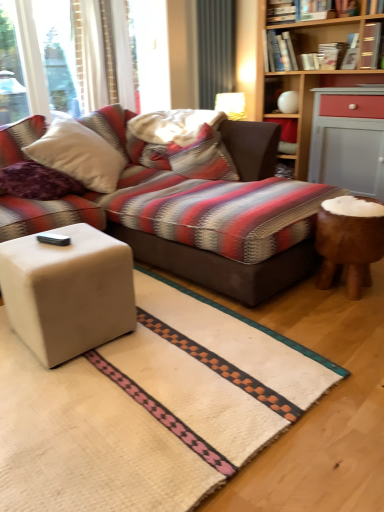
Locate an element on the screen. The width and height of the screenshot is (384, 512). striped fabric pillow at center, the first pillow when ordered from right to left is located at coordinates (193, 157).

The height and width of the screenshot is (512, 384). What do you see at coordinates (37, 182) in the screenshot?
I see `purple soft pillow at left, arranged as the 1th pillow when viewed from the left` at bounding box center [37, 182].

What do you see at coordinates (370, 45) in the screenshot? Image resolution: width=384 pixels, height=512 pixels. I see `wooden book at upper right, which is the seventh book from left to right` at bounding box center [370, 45].

The width and height of the screenshot is (384, 512). Describe the element at coordinates (279, 52) in the screenshot. I see `hardcover book at upper right, arranged as the 6th book when viewed from the right` at that location.

This screenshot has width=384, height=512. I want to click on hardcover book at upper right, the fourth book viewed from the right, so click(331, 55).

Does beige matte cube at lower left contain wooden book at upper right, which is the seventh book from left to right?

No, wooden book at upper right, which is the seventh book from left to right, is located outside of beige matte cube at lower left.

Can you tell me how much beige matte cube at lower left and wooden book at upper right, the first book viewed from the right, differ in facing direction?

The angle between the facing direction of beige matte cube at lower left and the facing direction of wooden book at upper right, the first book viewed from the right, is 82.6 degrees.

Is beige matte cube at lower left shorter than wooden book at upper right, the first book viewed from the right?

No.

From a real-world perspective, which is physically above, beige matte cube at lower left or wooden book at upper right, which is the seventh book from left to right?

From a 3D spatial view, wooden book at upper right, which is the seventh book from left to right, is above.

Is beige matte cube at lower left directly adjacent to hardcover book at upper right, placed as the 4th book when sorted from left to right?

No, beige matte cube at lower left is not touching hardcover book at upper right, placed as the 4th book when sorted from left to right.

From a real-world perspective, which object rests below the other?

beige matte cube at lower left is physically lower.

Considering the relative sizes of beige matte cube at lower left and hardcover book at upper right, the fourth book viewed from the right, in the image provided, is beige matte cube at lower left thinner than hardcover book at upper right, the fourth book viewed from the right,?

No.

Considering the positions of objects hardcover book at upper center, which is counted as the 3th book, starting from the left, and wooden book at upper right, which is the seventh book from left to right, in the image provided, who is more to the right, hardcover book at upper center, which is counted as the 3th book, starting from the left, or wooden book at upper right, which is the seventh book from left to right,?

From the viewer's perspective, wooden book at upper right, which is the seventh book from left to right, appears more on the right side.

How many degrees apart are the facing directions of hardcover book at upper center, positioned as the fifth book in right-to-left order, and wooden book at upper right, which is the seventh book from left to right?

There is a 0.0022-degree angle between the facing directions of hardcover book at upper center, positioned as the fifth book in right-to-left order, and wooden book at upper right, which is the seventh book from left to right.

Who is shorter, hardcover book at upper center, positioned as the fifth book in right-to-left order, or wooden book at upper right, which is the seventh book from left to right?

Standing shorter between the two is hardcover book at upper center, positioned as the fifth book in right-to-left order.

Between hardcover book at upper center, which is counted as the 3th book, starting from the left, and wooden book at upper right, the first book viewed from the right, which one has larger size?

With larger size is wooden book at upper right, the first book viewed from the right.

Is wooden book at upper right, the first book viewed from the right, far from wooden stool at right?

Yes, wooden book at upper right, the first book viewed from the right, is far from wooden stool at right.

Can you confirm if wooden book at upper right, which is the seventh book from left to right, is positioned to the left of wooden stool at right?

In fact, wooden book at upper right, which is the seventh book from left to right, is to the right of wooden stool at right.

I want to click on book that is the 1st object located above the wooden stool at right (from the image's perspective), so click(x=370, y=45).

Who is more distant, wooden book at upper right, the first book viewed from the right, or wooden stool at right?

wooden book at upper right, the first book viewed from the right.

Is hardcover book at upper right, arranged as the third book when viewed from the right, at the back of hardcover book at upper right, placed as the 4th book when sorted from left to right?

No, hardcover book at upper right, arranged as the third book when viewed from the right, is not at the back of hardcover book at upper right, placed as the 4th book when sorted from left to right.

From a real-world perspective, is hardcover book at upper right, the fourth book viewed from the right, physically above hardcover book at upper right, arranged as the third book when viewed from the right?

No, from a real-world perspective, hardcover book at upper right, the fourth book viewed from the right, is not on top of hardcover book at upper right, arranged as the third book when viewed from the right.

Considering the sizes of objects hardcover book at upper right, the fourth book viewed from the right, and hardcover book at upper right, positioned as the 5th book in left-to-right order, in the image provided, who is thinner, hardcover book at upper right, the fourth book viewed from the right, or hardcover book at upper right, positioned as the 5th book in left-to-right order,?

hardcover book at upper right, positioned as the 5th book in left-to-right order.

From the image's perspective, which is below, purple soft pillow at left, acting as the first pillow starting from the front, or hardcover book at upper center, which is the first book in left-to-right order?

From the image's view, purple soft pillow at left, acting as the first pillow starting from the front, is below.

Considering the sizes of objects purple soft pillow at left, acting as the first pillow starting from the front, and hardcover book at upper center, which is the first book in left-to-right order, in the image provided, who is bigger, purple soft pillow at left, acting as the first pillow starting from the front, or hardcover book at upper center, which is the first book in left-to-right order,?

With larger size is purple soft pillow at left, acting as the first pillow starting from the front.

In the scene shown: From a real-world perspective, is purple soft pillow at left, acting as the first pillow starting from the front, below hardcover book at upper center, the 7th book positioned from the right?

Indeed, from a real-world perspective, purple soft pillow at left, acting as the first pillow starting from the front, is positioned beneath hardcover book at upper center, the 7th book positioned from the right.

Are purple soft pillow at left, acting as the second pillow starting from the right, and hardcover book at upper center, which is the first book in left-to-right order, located far from each other?

Yes, purple soft pillow at left, acting as the second pillow starting from the right, is far from hardcover book at upper center, which is the first book in left-to-right order.

Is hardcover book at upper center, which is counted as the 3th book, starting from the left, at the right side of beige matte cube at lower left?

Yes, hardcover book at upper center, which is counted as the 3th book, starting from the left, is to the right of beige matte cube at lower left.

From a real-world perspective, is hardcover book at upper center, which is counted as the 3th book, starting from the left, physically above beige matte cube at lower left?

Yes, from a real-world perspective, hardcover book at upper center, which is counted as the 3th book, starting from the left, is above beige matte cube at lower left.

Who is bigger, hardcover book at upper center, positioned as the fifth book in right-to-left order, or beige matte cube at lower left?

beige matte cube at lower left.

Identify the location of the 3rd book located above the beige matte cube at lower left (from a real-world perspective). Image resolution: width=384 pixels, height=512 pixels. pos(370,45).

I want to click on coffee table on the left side of hardcover book at upper right, placed as the 4th book when sorted from left to right, so click(x=68, y=292).

From the image, which object appears to be farther from hardcover book at upper center, the 7th book positioned from the right, hardcover book at upper right, arranged as the 6th book when viewed from the right, or hardcover book at upper right, arranged as the third book when viewed from the right?

hardcover book at upper right, arranged as the third book when viewed from the right, lies further to hardcover book at upper center, the 7th book positioned from the right, than the other object.

Which object lies further to the anchor point beige matte cube at lower left, hardcover book at upper center, which is counted as the 3th book, starting from the left, or hardcover book at upper center, which is the first book in left-to-right order?

hardcover book at upper center, which is the first book in left-to-right order, is positioned further to the anchor beige matte cube at lower left.

When comparing their distances from beige matte cube at lower left, does hardcover book at upper right, arranged as the third book when viewed from the right, or purple soft pillow at left, acting as the second pillow starting from the right, seem further?

hardcover book at upper right, arranged as the third book when viewed from the right, lies further to beige matte cube at lower left than the other object.

Estimate the real-world distances between objects in this image. Which object is closer to wooden stool at right, striped fabric pillow at center, which is the 1th pillow in back-to-front order, or hardcover book at upper right, arranged as the third book when viewed from the right?

striped fabric pillow at center, which is the 1th pillow in back-to-front order, is positioned closer to the anchor wooden stool at right.

Looking at this image, which object lies nearer to the anchor point beige matte cube at lower left, purple soft pillow at left, the 2th pillow in the back-to-front sequence, or hardcover book at upper right, marked as the second book in a right-to-left arrangement?

The object closer to beige matte cube at lower left is purple soft pillow at left, the 2th pillow in the back-to-front sequence.

Looking at the image, which one is located further to hardcover book at upper center, the 7th book positioned from the right, purple soft pillow at left, the 2th pillow in the back-to-front sequence, or wooden stool at right?

purple soft pillow at left, the 2th pillow in the back-to-front sequence, lies further to hardcover book at upper center, the 7th book positioned from the right, than the other object.

Based on their spatial positions, is hardcover book at upper center, positioned as the fifth book in right-to-left order, or wooden stool at right closer to wooden book at upper right, the first book viewed from the right?

hardcover book at upper center, positioned as the fifth book in right-to-left order, is closer to wooden book at upper right, the first book viewed from the right.

Estimate the real-world distances between objects in this image. Which object is closer to hardcover book at upper center, which is the first book in left-to-right order, hardcover book at upper center, which is counted as the 3th book, starting from the left, or hardcover book at upper right, placed as the 4th book when sorted from left to right?

Based on the image, hardcover book at upper center, which is counted as the 3th book, starting from the left, appears to be nearer to hardcover book at upper center, which is the first book in left-to-right order.

Locate an element on the screen. The height and width of the screenshot is (512, 384). pillow between purple soft pillow at left, acting as the first pillow starting from the front, and hardcover book at upper right, the fourth book viewed from the right is located at coordinates (193, 157).

In order to click on pillow between purple soft pillow at left, arranged as the 1th pillow when viewed from the left, and hardcover book at upper center, which is counted as the 3th book, starting from the left, in the horizontal direction in this screenshot , I will do `click(193, 157)`.

This screenshot has height=512, width=384. I want to click on coffee table located between purple soft pillow at left, arranged as the 1th pillow when viewed from the left, and hardcover book at upper right, which is the 6th book from left to right, in the left-right direction, so click(68, 292).

Identify the location of book situated between hardcover book at upper right, arranged as the 6th book when viewed from the right, and hardcover book at upper right, the fourth book viewed from the right, from left to right. (310, 61).